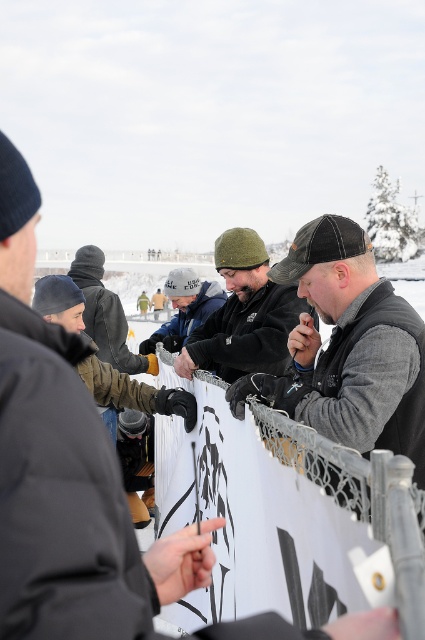
Between gray woolen sweater at center and white knit cap at center, which one has less height?

white knit cap at center is shorter.

Can you confirm if gray woolen sweater at center is thinner than white knit cap at center?

Yes.

Between point (345, 225) and point (167, 280), which one is positioned in front?

Positioned in front is point (345, 225).

You are a GUI agent. You are given a task and a screenshot of the screen. Output one action in this format:
    pyautogui.click(x=<x>, y=<y>)
    Task: Click on the gray woolen sweater at center
    
    Given the screenshot: What is the action you would take?
    pyautogui.click(x=348, y=348)

Where is `matte black jacket at center`? Image resolution: width=425 pixels, height=640 pixels. matte black jacket at center is located at coordinates (243, 314).

Does point (285, 308) come farther from viewer compared to point (170, 291)?

No, it is not.

Is point (220, 320) positioned in front of point (183, 320)?

Yes, point (220, 320) is closer to viewer.

The height and width of the screenshot is (640, 425). I want to click on matte black jacket at center, so click(243, 314).

Which is behind, point (336, 404) or point (218, 336)?

Point (218, 336)

Does gray woolen sweater at center have a greater height compared to matte black jacket at center?

In fact, gray woolen sweater at center may be shorter than matte black jacket at center.

Does point (272, 276) come closer to viewer compared to point (226, 264)?

Yes.

Find the location of a particular element. The width and height of the screenshot is (425, 640). gray woolen sweater at center is located at coordinates (348, 348).